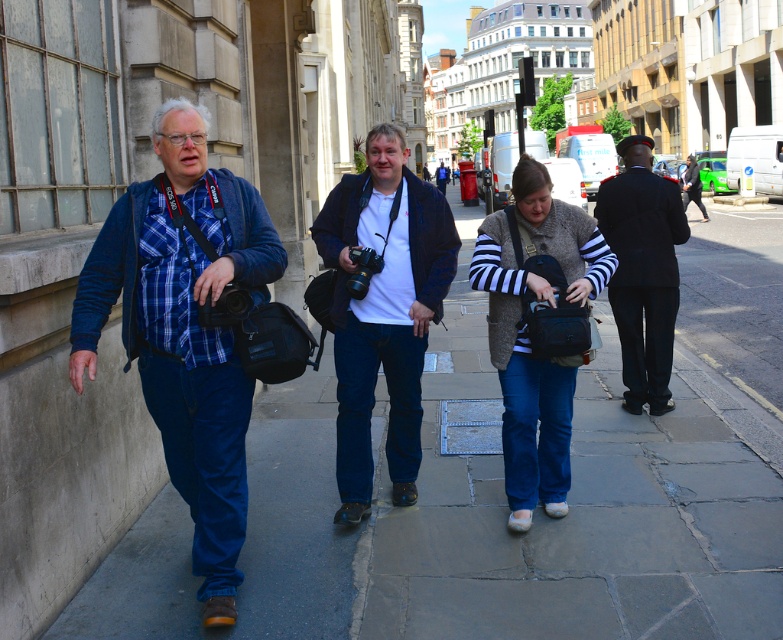
You are a photographer standing at the far right of the sidewalk. You want to take a photo of the dark blue suit at center without moving from your current position. Is the black plastic camera at left within your reach to do so?

The black plastic camera at left and dark blue suit at center are 20.76 meters apart. Since you are at the far right, the camera is 20.76 meters away, which is too far to reach. You would need to move closer.

You are a photographer trying to capture a photo of the dark blue suit at center without the black plastic camera at left blocking the view. Can you adjust your position to do so?

The black plastic camera at left is in front of the dark blue suit at center, so moving your position to the right or left might allow you to see around or over the camera and capture the dark blue suit at center without obstruction.